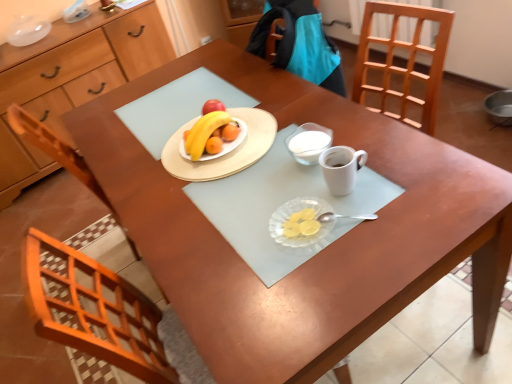
Question: Is the depth of white glass bowl at center less than that of transparent glass plate at center?

Choices:
 (A) yes
 (B) no

Answer: (B)

Question: From a real-world perspective, is white glass bowl at center over transparent glass plate at center?

Choices:
 (A) no
 (B) yes

Answer: (B)

Question: Considering the relative sizes of white glass bowl at center and transparent glass plate at center in the image provided, is white glass bowl at center taller than transparent glass plate at center?

Choices:
 (A) yes
 (B) no

Answer: (A)

Question: Does white glass bowl at center appear on the right side of transparent glass plate at center?

Choices:
 (A) yes
 (B) no

Answer: (A)

Question: Is white glass bowl at center bigger than transparent glass plate at center?

Choices:
 (A) no
 (B) yes

Answer: (B)

Question: Is white glass bowl at center aimed at transparent glass plate at center?

Choices:
 (A) no
 (B) yes

Answer: (A)

Question: Does white matte coffee cup at center contain matte wooden plate at center?

Choices:
 (A) yes
 (B) no

Answer: (B)

Question: From the image's perspective, is white matte coffee cup at center beneath matte wooden plate at center?

Choices:
 (A) yes
 (B) no

Answer: (A)

Question: Is white matte coffee cup at center further to camera compared to matte wooden plate at center?

Choices:
 (A) yes
 (B) no

Answer: (B)

Question: Is white matte coffee cup at center completely or partially outside of matte wooden plate at center?

Choices:
 (A) no
 (B) yes

Answer: (B)

Question: Is white matte coffee cup at center bigger than matte wooden plate at center?

Choices:
 (A) yes
 (B) no

Answer: (B)

Question: Is white matte coffee cup at center positioned with its back to matte wooden plate at center?

Choices:
 (A) no
 (B) yes

Answer: (A)

Question: Does white matte coffee cup at center appear on the left side of yellow matte grapefruit at center?

Choices:
 (A) yes
 (B) no

Answer: (B)